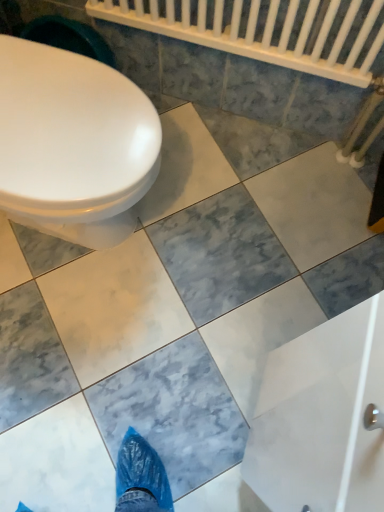
The width and height of the screenshot is (384, 512). I want to click on empty space that is to the right of white glossy toilet at left, so click(x=218, y=242).